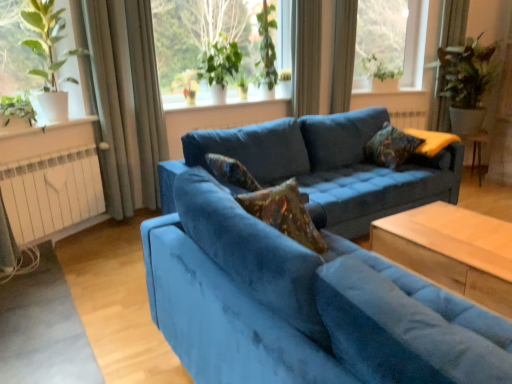
Question: Which direction should I rotate to face velvet-patterned pillow at center, which appears as the 1th pillow when viewed from the left, — up or down?

Choices:
 (A) up
 (B) down

Answer: (A)

Question: Does green leafy plant at upper left, which is the third window in right-to-left order, have a smaller size compared to velvet-patterned pillow at center, placed as the 3th pillow when sorted from right to left?

Choices:
 (A) no
 (B) yes

Answer: (A)

Question: Can you confirm if green leafy plant at upper left, which is the third window in right-to-left order, is positioned to the right of velvet-patterned pillow at center, placed as the 3th pillow when sorted from right to left?

Choices:
 (A) no
 (B) yes

Answer: (A)

Question: Is green leafy plant at upper left, which appears as the 3th window when viewed from the back, wider than velvet-patterned pillow at center, the 2th pillow when ordered from front to back?

Choices:
 (A) yes
 (B) no

Answer: (A)

Question: Is green leafy plant at upper left, which appears as the 3th window when viewed from the back, oriented towards velvet-patterned pillow at center, which appears as the 1th pillow when viewed from the left?

Choices:
 (A) yes
 (B) no

Answer: (A)

Question: From the image's perspective, is green leafy plant at upper left, which is the third window in right-to-left order, on top of velvet-patterned pillow at center, the 2th pillow when ordered from front to back?

Choices:
 (A) yes
 (B) no

Answer: (A)

Question: Considering the relative sizes of green leafy plant at upper left, which appears as the 3th window when viewed from the back, and velvet-patterned pillow at center, which appears as the 1th pillow when viewed from the left, in the image provided, is green leafy plant at upper left, which appears as the 3th window when viewed from the back, thinner than velvet-patterned pillow at center, which appears as the 1th pillow when viewed from the left,?

Choices:
 (A) no
 (B) yes

Answer: (A)

Question: Is satin curtain at upper center, the third curtain positioned from the left, turned away from velvet blue couch at center, positioned as the second studio couch in back-to-front order?

Choices:
 (A) no
 (B) yes

Answer: (A)

Question: Considering the relative positions of satin curtain at upper center, the 2th curtain positioned from the right, and velvet blue couch at center, positioned as the second studio couch in back-to-front order, in the image provided, is satin curtain at upper center, the 2th curtain positioned from the right, to the left of velvet blue couch at center, positioned as the second studio couch in back-to-front order, from the viewer's perspective?

Choices:
 (A) yes
 (B) no

Answer: (B)

Question: Is satin curtain at upper center, the 2th curtain positioned from the right, shorter than velvet blue couch at center, positioned as the second studio couch in back-to-front order?

Choices:
 (A) no
 (B) yes

Answer: (A)

Question: From a real-world perspective, is satin curtain at upper center, the 2th curtain positioned from the right, physically above velvet blue couch at center, positioned as the second studio couch in back-to-front order?

Choices:
 (A) no
 (B) yes

Answer: (B)

Question: Does satin curtain at upper center, the third curtain positioned from the left, touch velvet blue couch at center, the first studio couch in the front-to-back sequence?

Choices:
 (A) yes
 (B) no

Answer: (B)

Question: Is satin curtain at upper center, the 2th curtain positioned from the right, at the right side of velvet blue couch at center, positioned as the second studio couch in back-to-front order?

Choices:
 (A) yes
 (B) no

Answer: (A)

Question: Is transparent glass window at upper right, the first window from the right, at the left side of green leafy plants at upper center, which is the 2th window in back-to-front order?

Choices:
 (A) no
 (B) yes

Answer: (A)